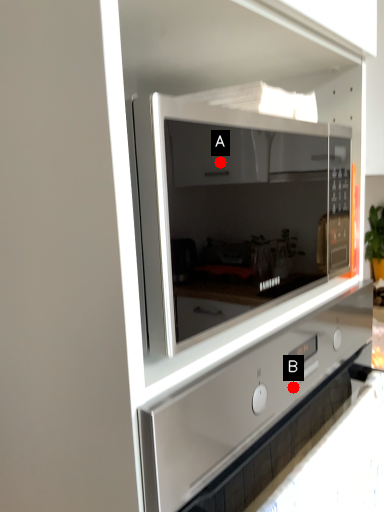
Question: Two points are circled on the image, labeled by A and B beside each circle. Which of the following is the farthest from the observer?

Choices:
 (A) A is further
 (B) B is further

Answer: (A)